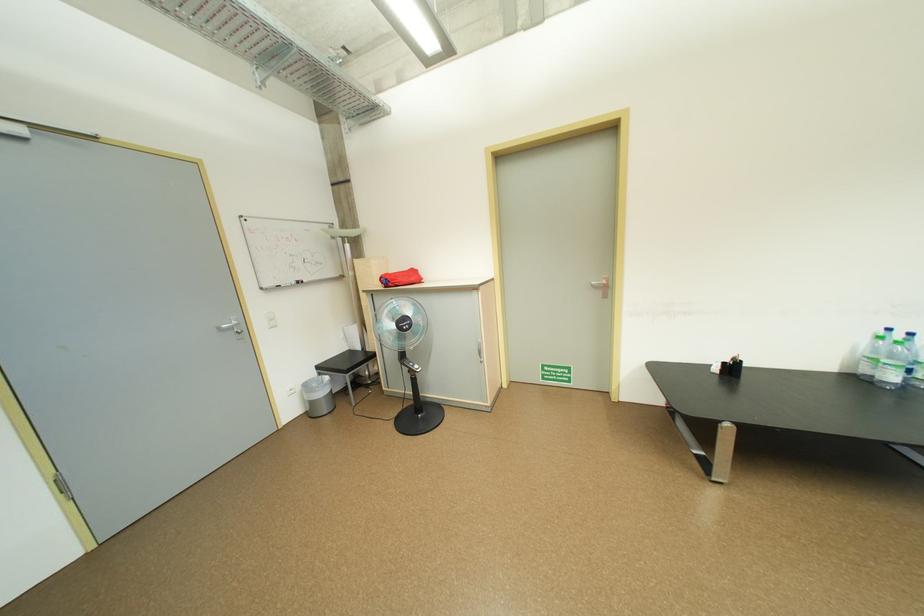
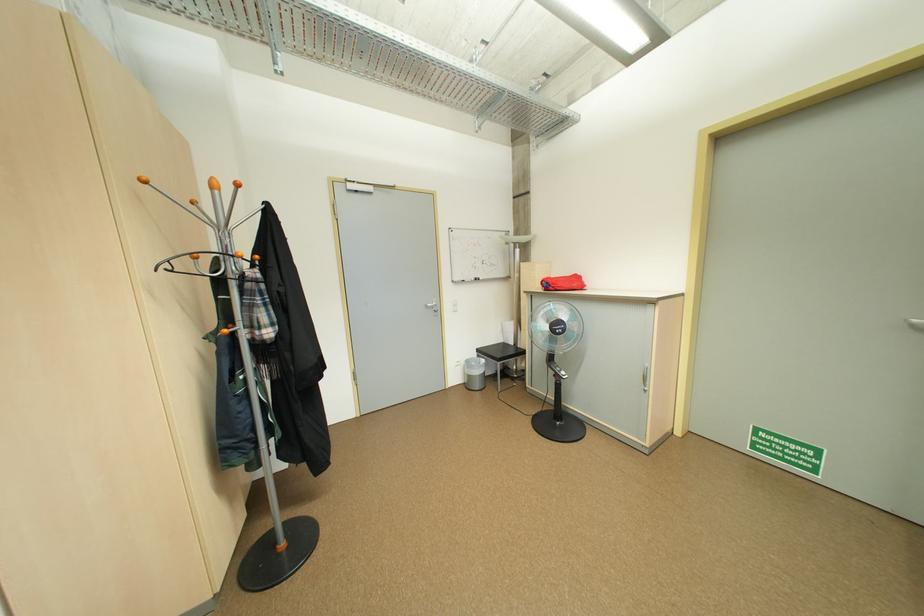
Locate, in the second image, the point that corresponds to (320,415) in the first image.

(476, 387)